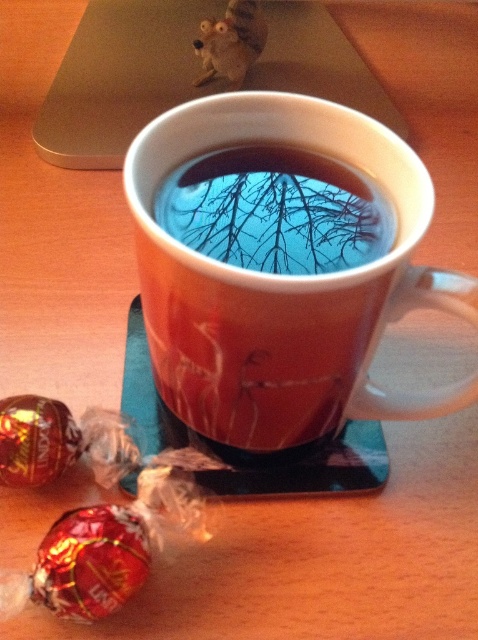
Who is lower down, transparent glass tea at center or shiny metallic lollipop at lower left?

Positioned lower is shiny metallic lollipop at lower left.

Is point (175, 189) farther from camera compared to point (71, 602)?

That is True.

Is point (275, 272) positioned behind point (99, 564)?

Yes, point (275, 272) is behind point (99, 564).

Where is `transparent glass tea at center`? This screenshot has height=640, width=478. transparent glass tea at center is located at coordinates (275, 211).

Between silver metallic laptop at upper center and transparent glass tea at center, which one appears on the left side from the viewer's perspective?

silver metallic laptop at upper center

Is silver metallic laptop at upper center thinner than transparent glass tea at center?

In fact, silver metallic laptop at upper center might be wider than transparent glass tea at center.

Which is in front, point (358, 72) or point (271, 273)?

Point (271, 273) is more forward.

The width and height of the screenshot is (478, 640). In order to click on silver metallic laptop at upper center in this screenshot , I will do coord(120,77).

Who is lower down, silver metallic laptop at upper center or shiny foil wrapped chocolate at lower left?

Positioned lower is shiny foil wrapped chocolate at lower left.

Where is `silver metallic laptop at upper center`? The image size is (478, 640). silver metallic laptop at upper center is located at coordinates (120, 77).

The height and width of the screenshot is (640, 478). I want to click on silver metallic laptop at upper center, so click(120, 77).